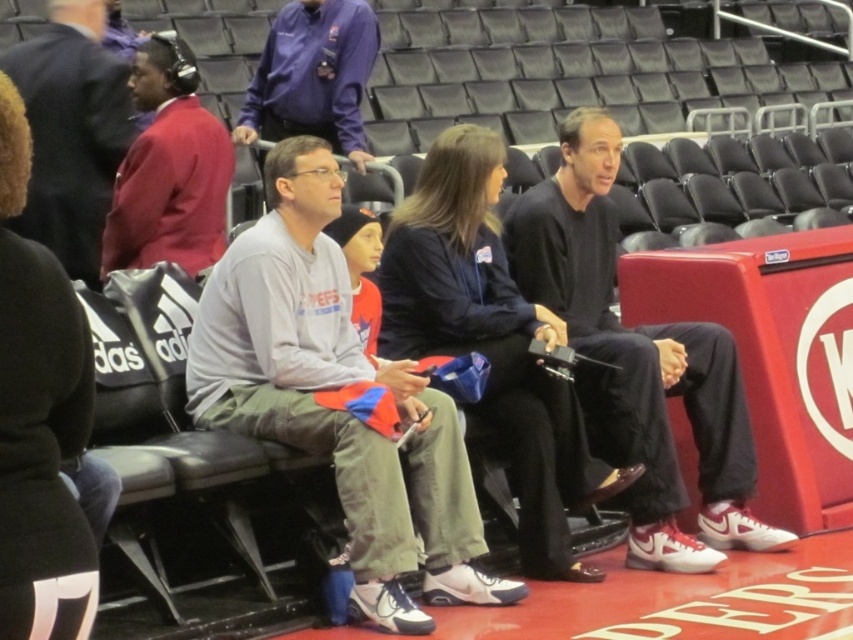
Question: Does black matte pants at center have a greater width compared to dark gray sweatshirt at center?

Choices:
 (A) yes
 (B) no

Answer: (A)

Question: Does black matte pants at center have a larger size compared to matte red jacket at left?

Choices:
 (A) yes
 (B) no

Answer: (A)

Question: Which point is closer to the camera?

Choices:
 (A) coord(556,205)
 (B) coord(68,218)
 (C) coord(248,362)
 (D) coord(177,115)

Answer: (C)

Question: Which of the following is the closest to the observer?

Choices:
 (A) black matte pants at center
 (B) matte red jacket at left
 (C) purple smooth shirt at upper center
 (D) dark gray sweatshirt at center

Answer: (A)

Question: Is matte red jacket at left bigger than purple smooth shirt at upper center?

Choices:
 (A) yes
 (B) no

Answer: (A)

Question: Which object is the farthest from the black matte pants at center?

Choices:
 (A) gray fleece sweatshirt at center
 (B) purple smooth shirt at upper center

Answer: (B)